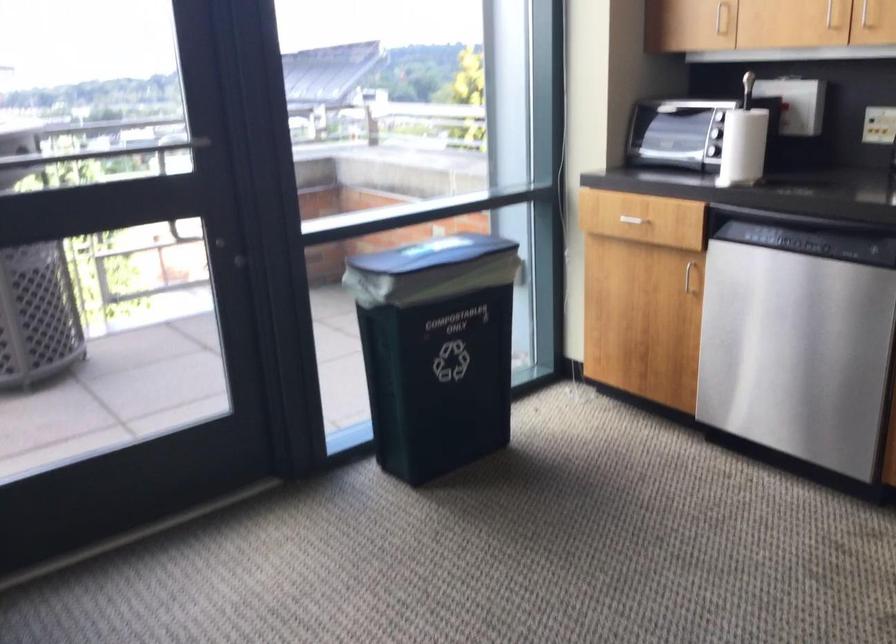
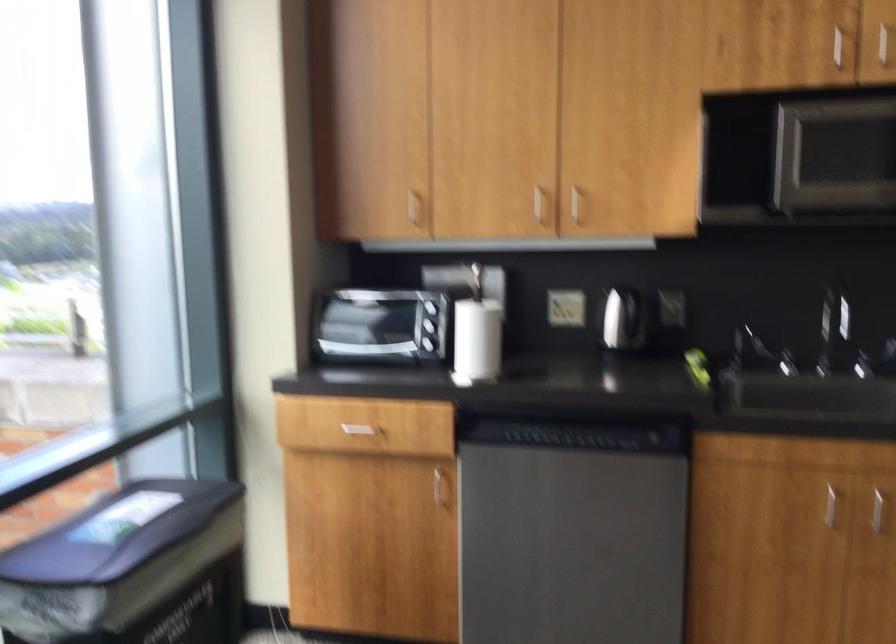
Question: The first image is from the beginning of the video and the second image is from the end. How did the camera likely rotate when shooting the video?

Choices:
 (A) Left
 (B) Right
 (C) Up
 (D) Down

Answer: (B)